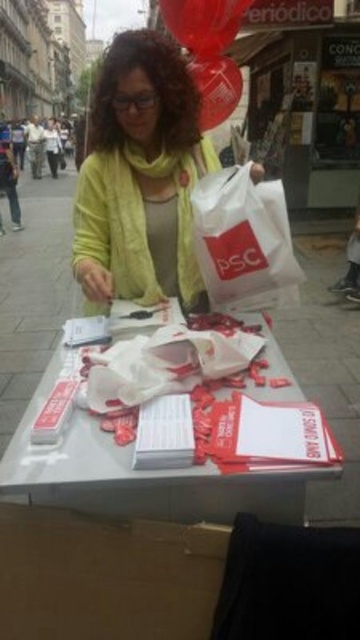
Question: Can you confirm if white plastic bag at center is smaller than rubberized glossy balloon at upper center?

Choices:
 (A) no
 (B) yes

Answer: (B)

Question: Among these points, which one is farthest from the camera?

Choices:
 (A) (95, 115)
 (B) (218, 58)
 (C) (208, 184)
 (D) (186, 20)

Answer: (B)

Question: Is matte yellow cardigan at center further to the viewer compared to white plastic bag at center?

Choices:
 (A) yes
 (B) no

Answer: (A)

Question: Is brown cardboard box at lower left positioned in front of white plastic bag at center?

Choices:
 (A) yes
 (B) no

Answer: (A)

Question: Which of these objects is positioned closest to the matte yellow cardigan at center?

Choices:
 (A) rubberized glossy balloon at upper center
 (B) rubber balloon at upper center
 (C) white paper at center
 (D) brown cardboard box at lower left

Answer: (A)

Question: Estimate the real-world distances between objects in this image. Which object is farther from the white paper at center?

Choices:
 (A) brown cardboard box at lower left
 (B) white plastic bag at center
 (C) rubber balloon at upper center
 (D) rubberized glossy balloon at upper center

Answer: (C)